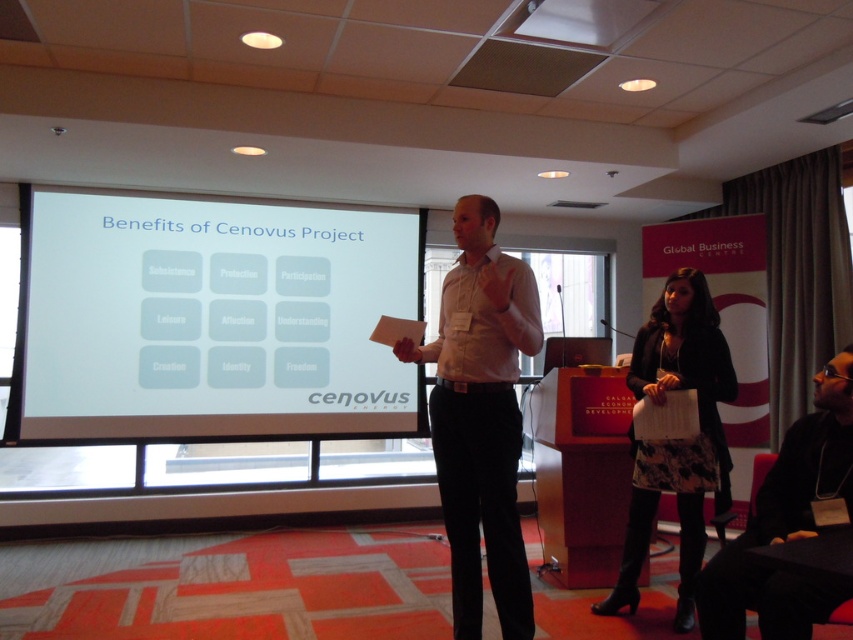
You are a presenter standing in front of the screen and need to point out two specific points on the slide. The first point is at coordinates point (502, 369) and the second point is at point (738, 586). Which of these points is closer to you?

Point (502, 369) is further to the viewer than point (738, 586), so the second point is closer to you.

You are a presenter standing at the front of the room. You want to point to the center of the white matte projection screen at center. Where should you aim your pointer? Is it at the point labeled as point (209, 321)?

The point labeled as point (209, 321) is on the white matte projection screen at center, so yes, you should aim your pointer at that point to hit the center of the white matte projection screen at center.

You are an attendee at the presentation and want to take a photo of the white matte projection screen at center. However, there is a presenter wearing a white shirt at center blocking your view. Can you see the screen clearly?

The white matte projection screen at center is larger than the white shirt at center, so you can still see the screen clearly despite the presenter wearing the white shirt at center blocking part of it.